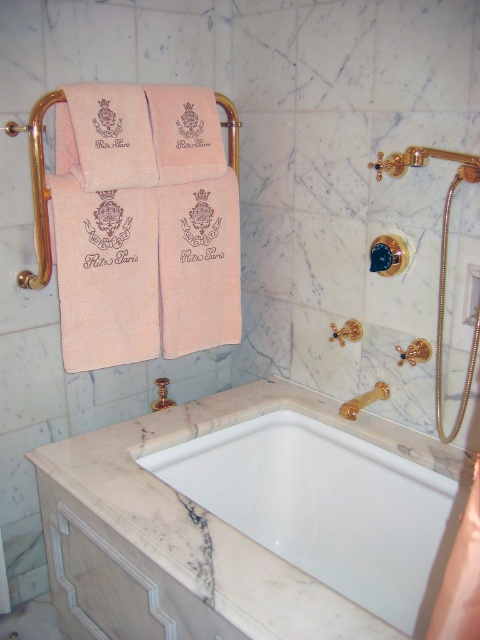
From the picture: You are a guest staying at the Ritz Paris and want to grab a towel to dry yourself after a shower. The bathroom has a pink cotton towel at center and a gold metallic shower handle at upper right. Which object is closer to the left side of the bathroom?

The pink cotton towel at center is closer to the left side of the bathroom because it is positioned to the left of the gold metallic shower handle at upper right.

You are standing in the luxurious bathroom and want to place a new decorative vase on the white marble bathtub at center. According to the coordinates provided, where exactly should you place the vase?

The white marble bathtub at center is located at point (x=326, y=508), so you should place the decorative vase at those coordinates on the bathtub.

You are a guest in this bathroom and want to place a small vase on the marble countertop near the gold towel rack. The marble countertop has coordinates ranging from 0.3 to 0.5 on the x and y axes. Is the point at (199, 264) within the marble countertop area?

The point at (199, 264) is within the marble countertop area since it falls within the x and y coordinates of 0.3 to 0.5.